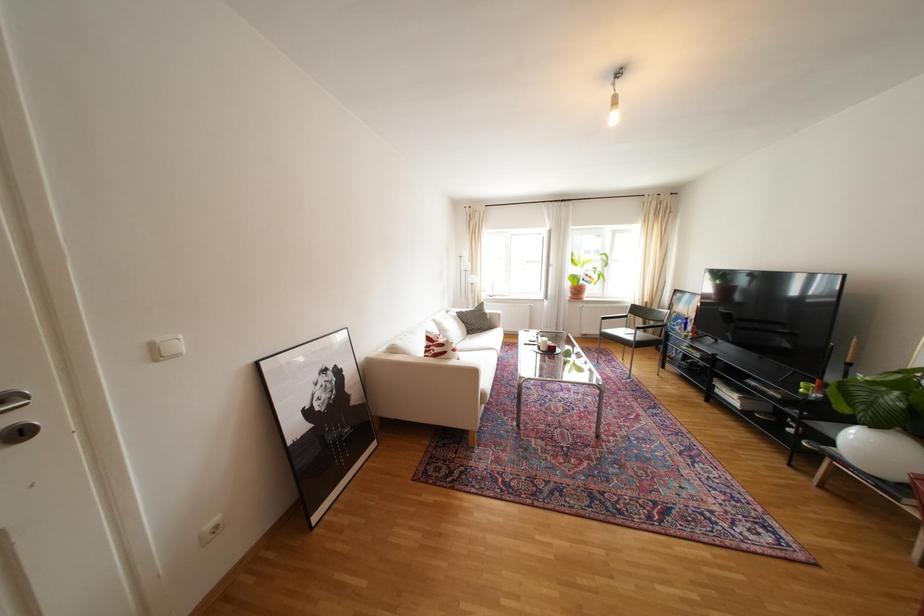
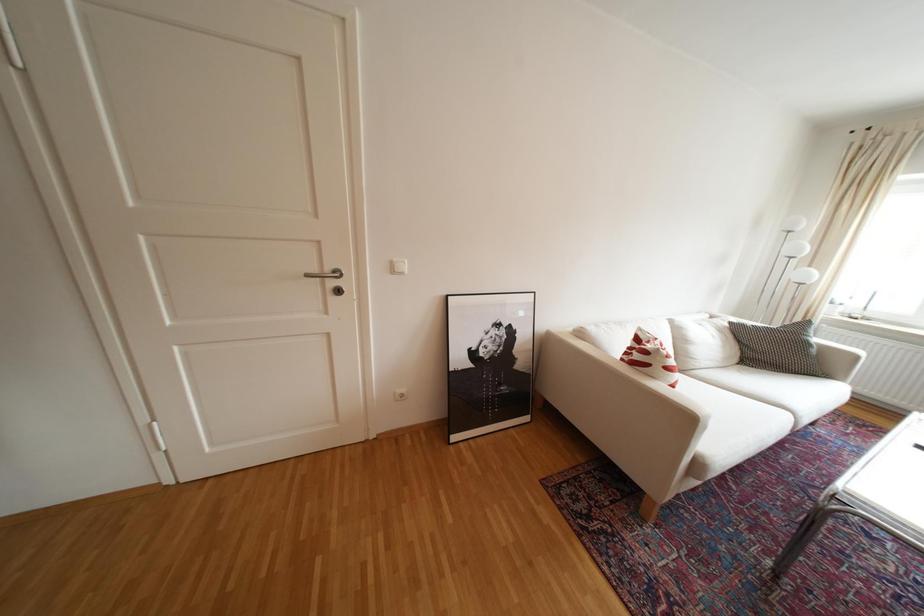
Question: How did the camera likely rotate?

Choices:
 (A) Left
 (B) Right
 (C) Up
 (D) Down

Answer: (A)